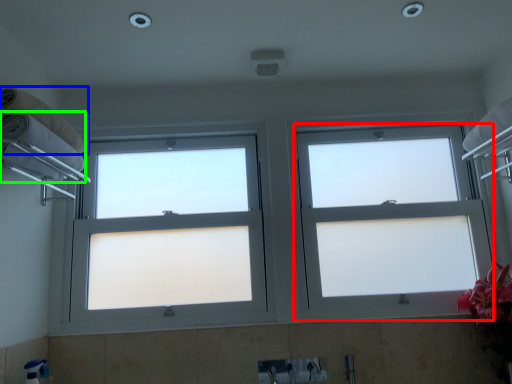
Question: Which object is positioned closest to window (highlighted by a red box)? Select from towel (highlighted by a blue box) and towel (highlighted by a green box).

Choices:
 (A) towel
 (B) towel

Answer: (B)